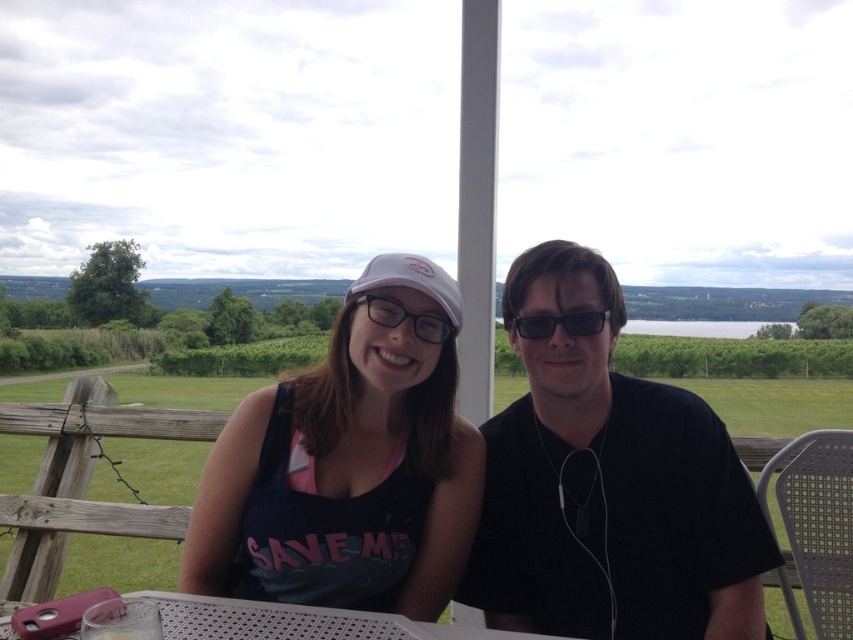
Does matte pink cap at center appear under white plastic table at lower center?

No, matte pink cap at center is not below white plastic table at lower center.

Between matte pink cap at center and white plastic table at lower center, which one has more height?

Standing taller between the two is matte pink cap at center.

Between point (428, 387) and point (521, 634), which one is positioned behind?

Point (428, 387)

Find the location of a particular element. The image size is (853, 640). matte pink cap at center is located at coordinates [347, 468].

Looking at this image, is black matte shirt at center to the right of matte white cap at center from the viewer's perspective?

Yes, black matte shirt at center is to the right of matte white cap at center.

Does black matte shirt at center have a smaller size compared to matte white cap at center?

No.

The width and height of the screenshot is (853, 640). What are the coordinates of `black matte shirt at center` in the screenshot? It's located at (608, 486).

Measure the distance between matte pink cap at center and camera.

They are 5.45 feet apart.

Does point (302, 499) come farther from viewer compared to point (537, 317)?

No, (302, 499) is in front of (537, 317).

Is point (296, 435) less distant than point (527, 320)?

No, (296, 435) is further to viewer.

The image size is (853, 640). In order to click on matte pink cap at center in this screenshot , I will do `click(347, 468)`.